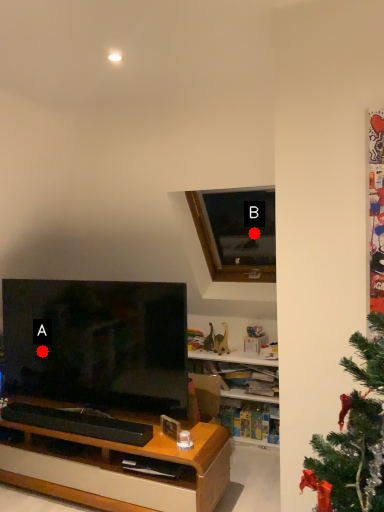
Question: Two points are circled on the image, labeled by A and B beside each circle. Which of the following is the closest to the observer?

Choices:
 (A) A is closer
 (B) B is closer

Answer: (A)